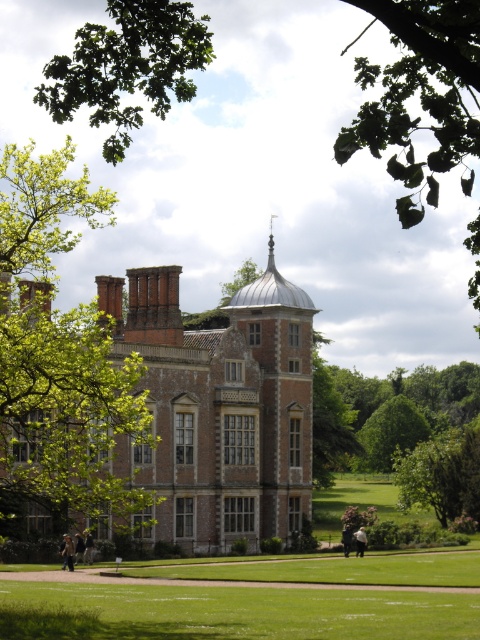
Is green leafy tree at upper left thinner than green grass lawn at center?

Incorrect, green leafy tree at upper left's width is not less than green grass lawn at center's.

Is point (189, 64) positioned before point (155, 586)?

Yes, point (189, 64) is closer to viewer.

At what (x,y) coordinates should I click in order to perform the action: click on green leafy tree at upper left. Please return your answer as a coordinate pair (x, y). Looking at the image, I should click on (419, 93).

Does green leafy tree at left appear on the left side of green grass lawn at center?

Indeed, green leafy tree at left is positioned on the left side of green grass lawn at center.

The height and width of the screenshot is (640, 480). Find the location of `green leafy tree at left`. green leafy tree at left is located at coordinates pos(59,353).

Image resolution: width=480 pixels, height=640 pixels. I want to click on green leafy tree at left, so click(x=59, y=353).

Is green leafy tree at left positioned in front of green leafy tree at upper left?

No, green leafy tree at left is behind green leafy tree at upper left.

Describe the element at coordinates (59, 353) in the screenshot. I see `green leafy tree at left` at that location.

Who is more distant from viewer, (46, 497) or (432, 164)?

The point (46, 497) is more distant.

Image resolution: width=480 pixels, height=640 pixels. In order to click on green leafy tree at left in this screenshot , I will do `click(59, 353)`.